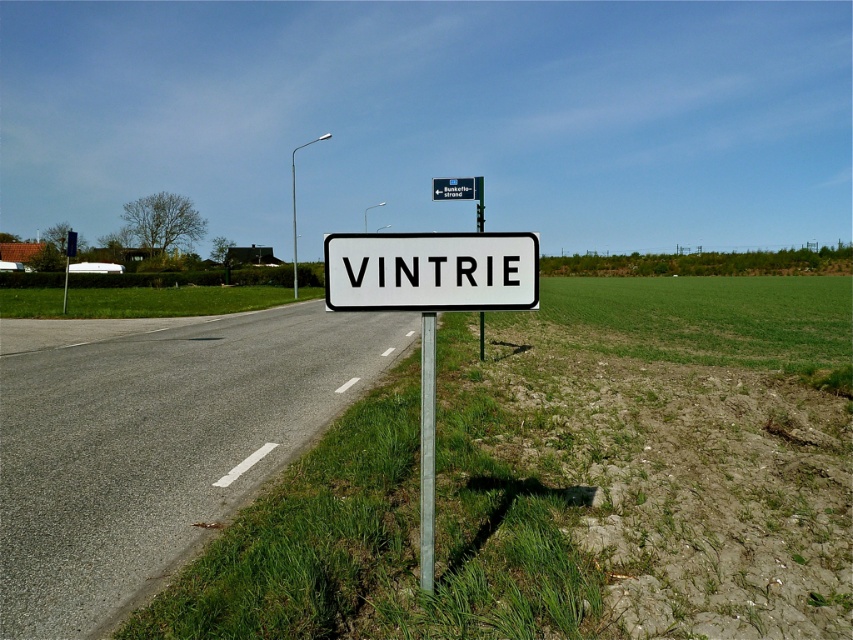
Who is positioned more to the right, white plastic sign at center or green plastic sign at center?

green plastic sign at center

Does white plastic sign at center appear on the right side of green plastic sign at center?

No, white plastic sign at center is not to the right of green plastic sign at center.

Find the location of a particular element. Image resolution: width=853 pixels, height=640 pixels. white plastic sign at center is located at coordinates (430, 269).

Is point (172, 413) closer to camera compared to point (422, 492)?

No.

Is gray asphalt road at center to the right of metallic pole at center from the viewer's perspective?

Incorrect, gray asphalt road at center is not on the right side of metallic pole at center.

Image resolution: width=853 pixels, height=640 pixels. I want to click on gray asphalt road at center, so click(x=154, y=442).

Who is shorter, gray asphalt road at center or green plastic sign at center?

gray asphalt road at center is shorter.

Who is lower down, gray asphalt road at center or green plastic sign at center?

gray asphalt road at center is lower down.

From the picture: Who is more distant from viewer, (160, 577) or (476, 182)?

The point (476, 182) is more distant.

Locate an element on the screen. This screenshot has width=853, height=640. gray asphalt road at center is located at coordinates (154, 442).